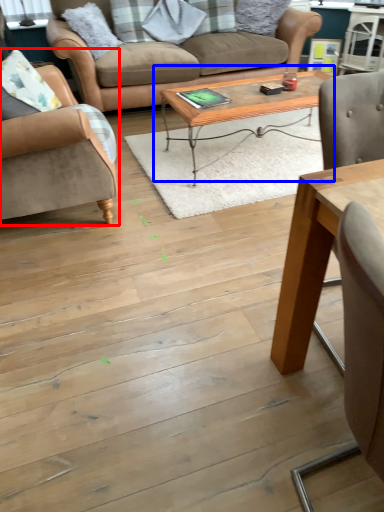
Question: Which point is further to the camera, chair (highlighted by a red box) or coffee table (highlighted by a blue box)?

Choices:
 (A) chair
 (B) coffee table

Answer: (B)